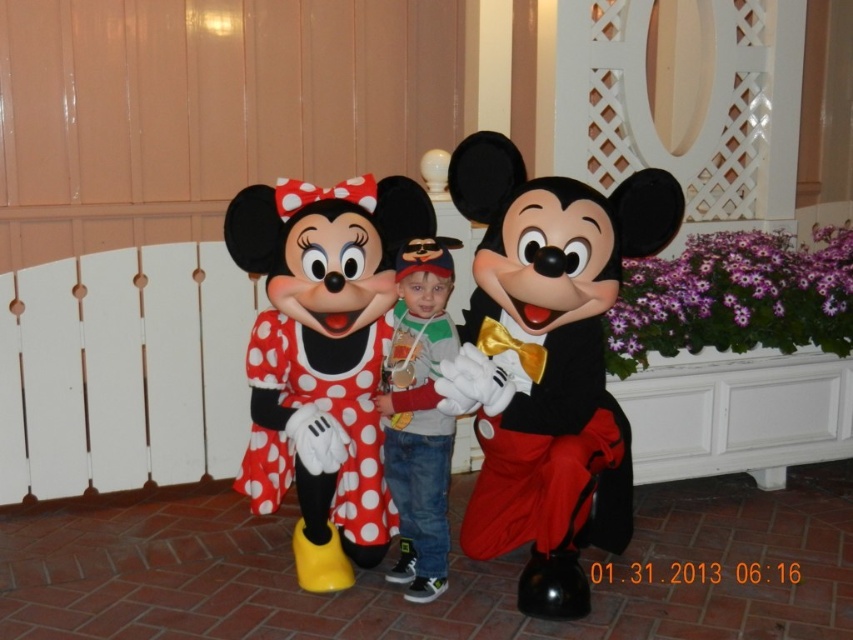
From the picture: You are a photographer trying to capture a clear shot of both the matte polka dot dress at center and the red polka dot dress at center. Which dress will appear larger in your photo?

The matte polka dot dress at center will appear larger in the photo because it is closer to the viewer than the red polka dot dress at center.

You are a photographer trying to capture a clear photo of the red polka dot dress at center and the jeans at center. Which object should you focus on first if you want to ensure both are in focus?

You should focus on the jeans at center first because it is closer to the camera than the red polka dot dress at center, ensuring both will be in focus when focused on the closer object.